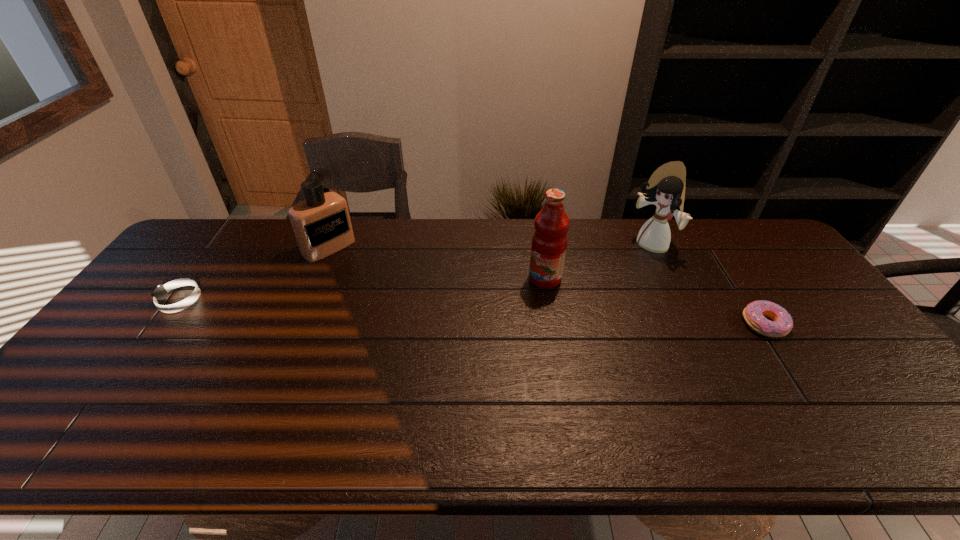
The width and height of the screenshot is (960, 540). In order to click on vacant space located 0.260m on the front label of the second object from left to right in this screenshot , I will do `click(390, 298)`.

The width and height of the screenshot is (960, 540). Find the location of `free point located 0.140m at the front face of the doll`. free point located 0.140m at the front face of the doll is located at coordinates (611, 272).

Locate an element on the screen. The image size is (960, 540). free space located 0.190m at the front face of the doll is located at coordinates (600, 279).

Locate an element on the screen. free space located at the front face of the doll is located at coordinates (556, 306).

Identify the location of free point located on the front label of the fruit juice. (446, 326).

Find the location of a particular element. The width and height of the screenshot is (960, 540). free region located on the front label of the fruit juice is located at coordinates (494, 303).

The height and width of the screenshot is (540, 960). Identify the location of free spot located on the front label of the fruit juice. (514, 294).

You are a GUI agent. You are given a task and a screenshot of the screen. Output one action in this format:
    pyautogui.click(x=<x>, y=<y>)
    Task: Click on the perfume that is at the far edge
    This screenshot has width=960, height=540.
    Given the screenshot: What is the action you would take?
    pyautogui.click(x=321, y=223)

Locate an element on the screen. doll present at the far edge is located at coordinates (666, 187).

Where is `object at the left edge`? The width and height of the screenshot is (960, 540). object at the left edge is located at coordinates (160, 293).